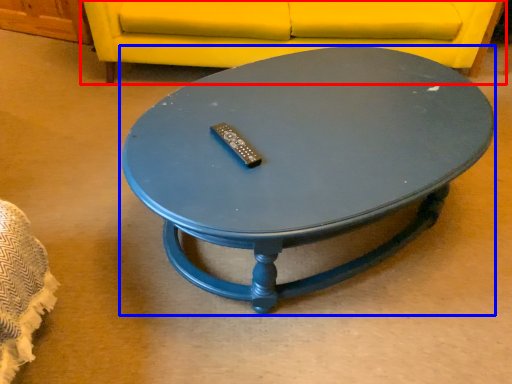
Question: Among these objects, which one is nearest to the camera, studio couch (highlighted by a red box) or coffee table (highlighted by a blue box)?

Choices:
 (A) studio couch
 (B) coffee table

Answer: (B)